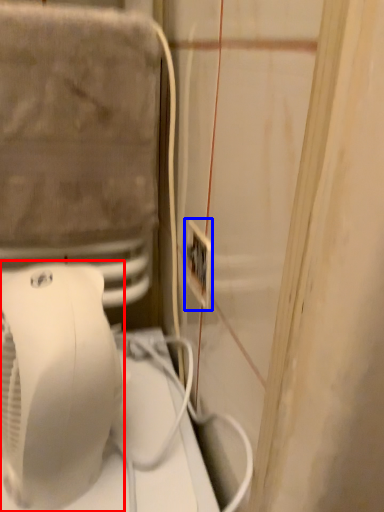
Question: Which object is further to the camera taking this photo, home appliance (highlighted by a red box) or electric outlet (highlighted by a blue box)?

Choices:
 (A) home appliance
 (B) electric outlet

Answer: (B)